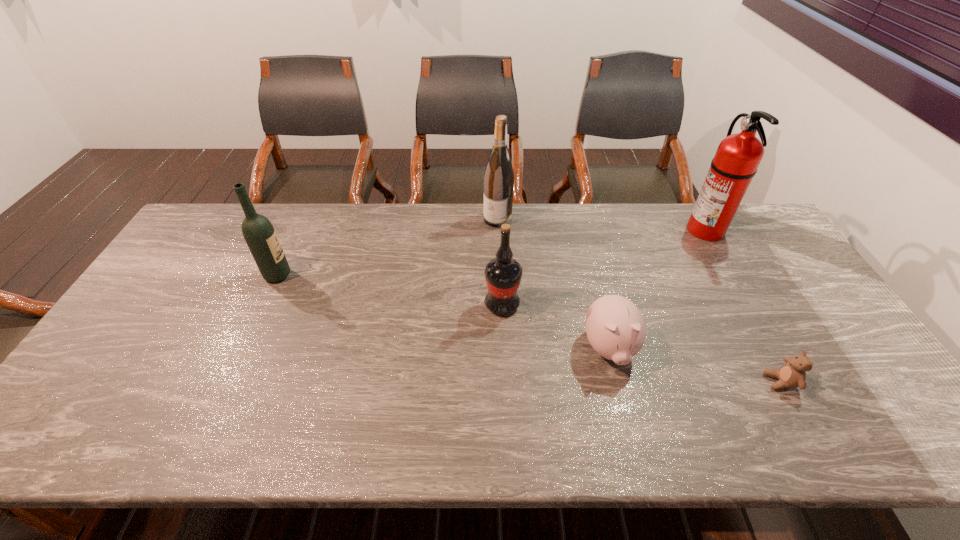
You are a GUI agent. You are given a task and a screenshot of the screen. Output one action in this format:
    pyautogui.click(x=<x>, y=<y>)
    Task: Click on the free region that satisfies the following two spatial constraints: 1. on the front side of the nearest wine bottle; 2. on the right side of the farthest wine bottle
    
    Given the screenshot: What is the action you would take?
    pyautogui.click(x=501, y=305)

In order to click on blank space that satisfies the following two spatial constraints: 1. at the nozzle of the fire extinguisher; 2. on the front side of the third nearest object in this screenshot , I will do `click(748, 305)`.